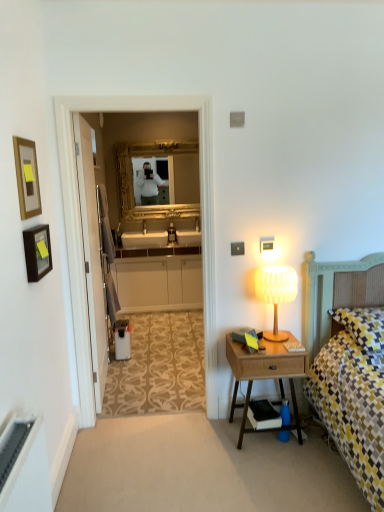
Question: From a real-world perspective, is white matte cabinet at center physically above gold ornate mirror at center?

Choices:
 (A) no
 (B) yes

Answer: (A)

Question: Is white matte cabinet at center in front of gold ornate mirror at center?

Choices:
 (A) no
 (B) yes

Answer: (B)

Question: Is gold ornate mirror at center surrounded by white matte cabinet at center?

Choices:
 (A) no
 (B) yes

Answer: (A)

Question: Is white matte cabinet at center turned away from gold ornate mirror at center?

Choices:
 (A) yes
 (B) no

Answer: (B)

Question: Does white matte cabinet at center appear on the left side of gold ornate mirror at center?

Choices:
 (A) no
 (B) yes

Answer: (B)

Question: Does white matte cabinet at center lie behind gold ornate mirror at center?

Choices:
 (A) yes
 (B) no

Answer: (B)

Question: From a real-world perspective, is woodenmaterial/texturenightstand at right under wooden picture frame at left, the 1th picture frame positioned from the bottom?

Choices:
 (A) yes
 (B) no

Answer: (A)

Question: Is woodenmaterial/texturenightstand at right positioned in front of wooden picture frame at left, which is the 2th picture frame from top to bottom?

Choices:
 (A) no
 (B) yes

Answer: (A)

Question: Considering the relative sizes of woodenmaterial/texturenightstand at right and wooden picture frame at left, which is the 2th picture frame from top to bottom, in the image provided, is woodenmaterial/texturenightstand at right wider than wooden picture frame at left, which is the 2th picture frame from top to bottom,?

Choices:
 (A) yes
 (B) no

Answer: (A)

Question: From the image's perspective, is woodenmaterial/texturenightstand at right located above wooden picture frame at left, which is the 2th picture frame from top to bottom?

Choices:
 (A) no
 (B) yes

Answer: (A)

Question: Considering the relative sizes of woodenmaterial/texturenightstand at right and wooden picture frame at left, which is the 2th picture frame from top to bottom, in the image provided, is woodenmaterial/texturenightstand at right smaller than wooden picture frame at left, which is the 2th picture frame from top to bottom,?

Choices:
 (A) no
 (B) yes

Answer: (A)

Question: Is woodenmaterial/texturenightstand at right shorter than wooden picture frame at left, the 1th picture frame positioned from the bottom?

Choices:
 (A) no
 (B) yes

Answer: (A)

Question: Is white ribbed glass table lamp at right positioned in front of white matte cabinet at center?

Choices:
 (A) no
 (B) yes

Answer: (B)